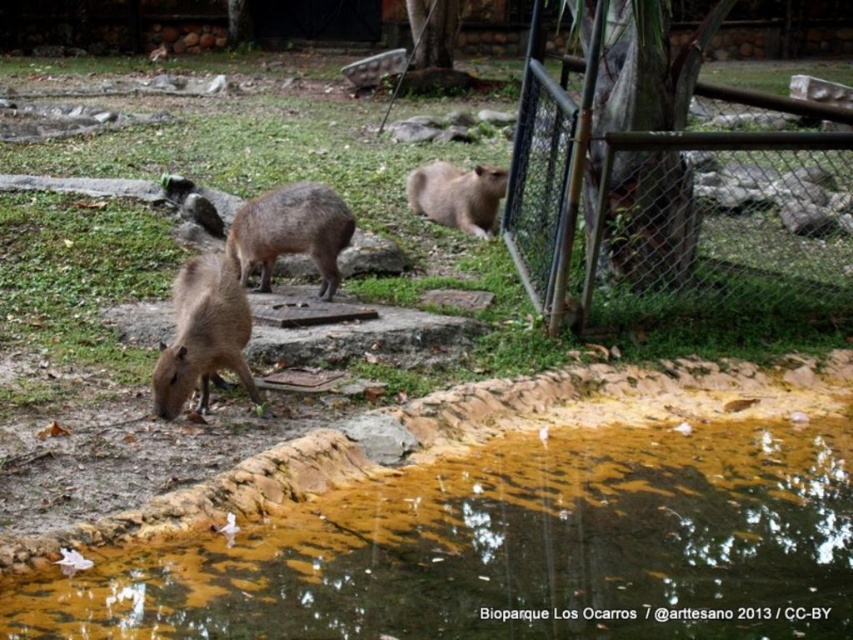
Which is above, metal mesh fence at upper right or fuzzy brown capybara at center?

metal mesh fence at upper right is above.

Can you confirm if metal mesh fence at upper right is positioned to the right of fuzzy brown capybara at center?

Correct, you'll find metal mesh fence at upper right to the right of fuzzy brown capybara at center.

Which is behind, point (651, 228) or point (480, 177)?

Positioned behind is point (480, 177).

Find the location of a particular element. This screenshot has height=640, width=853. metal mesh fence at upper right is located at coordinates (671, 186).

Between brown algae water at lower center and brown furry capybara at lower left, which one has less height?

brown algae water at lower center is shorter.

Between point (546, 616) and point (245, 340), which one is positioned behind?

The point (245, 340) is behind.

Which is in front, point (749, 484) or point (189, 304)?

Point (749, 484) is more forward.

Locate an element on the screen. Image resolution: width=853 pixels, height=640 pixels. brown algae water at lower center is located at coordinates (511, 548).

Who is taller, metal mesh fence at upper right or brown furry capybara at center?

metal mesh fence at upper right is taller.

Which of these two, metal mesh fence at upper right or brown furry capybara at center, stands shorter?

Standing shorter between the two is brown furry capybara at center.

Describe the element at coordinates (671, 186) in the screenshot. Image resolution: width=853 pixels, height=640 pixels. I see `metal mesh fence at upper right` at that location.

Where is `metal mesh fence at upper right`? metal mesh fence at upper right is located at coordinates (671, 186).